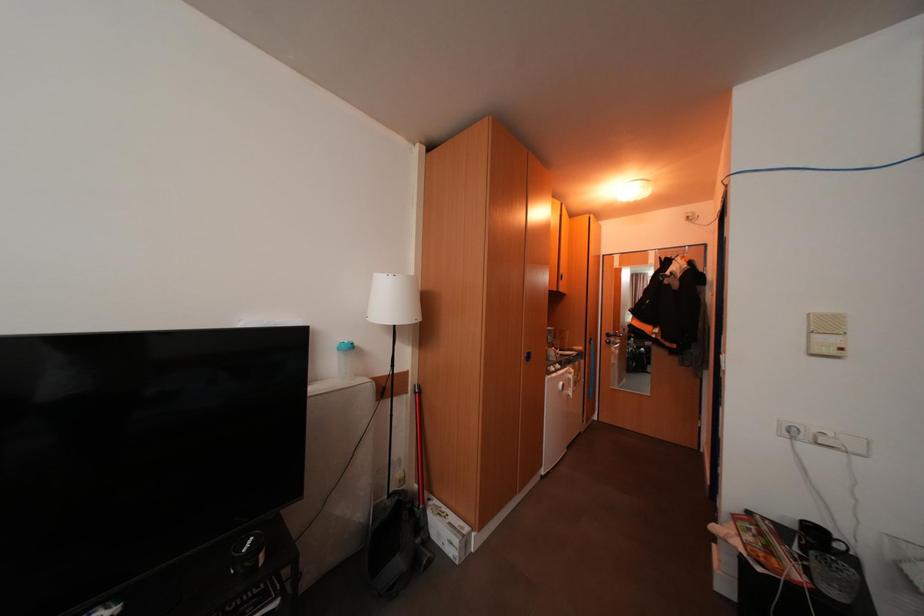
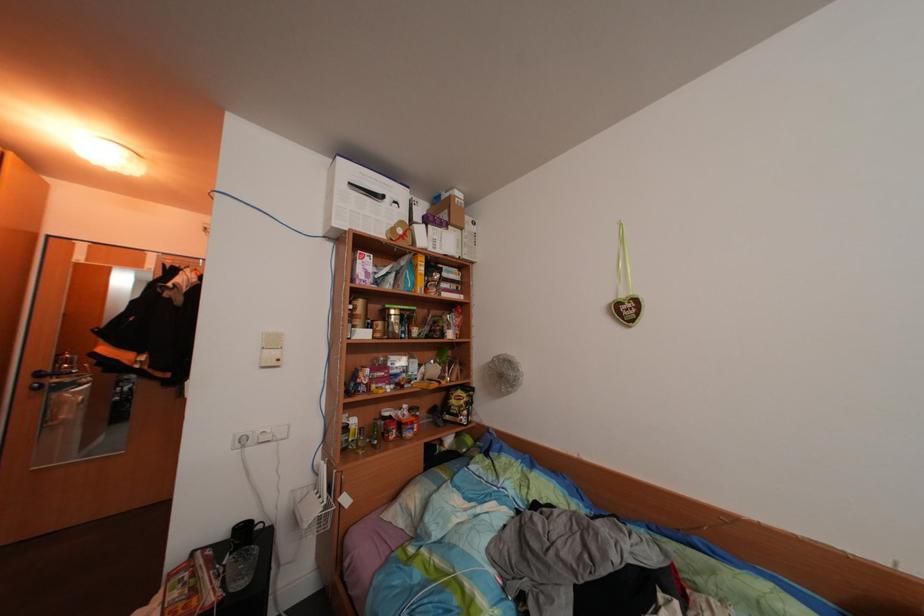
Question: The images are taken continuously from a first-person perspective. In which direction is your viewpoint rotating?

Choices:
 (A) Left
 (B) Right
 (C) Up
 (D) Down

Answer: (B)